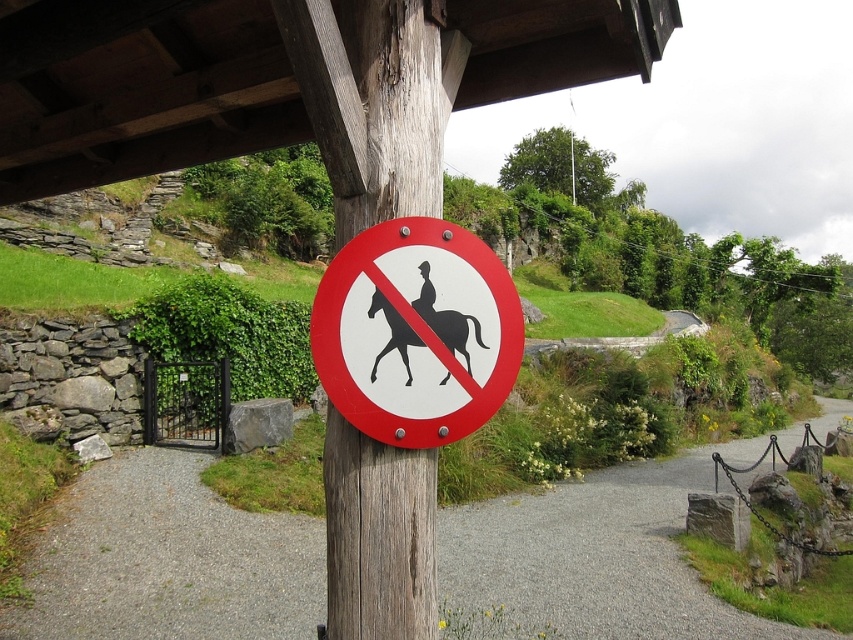
Can you confirm if wooden post at center is smaller than black matte horse at center?

No.

Can you confirm if wooden post at center is positioned to the left of black matte horse at center?

Yes, wooden post at center is to the left of black matte horse at center.

Between point (376, 164) and point (454, 340), which one is positioned behind?

Positioned behind is point (376, 164).

This screenshot has width=853, height=640. Find the location of `wooden post at center`. wooden post at center is located at coordinates (378, 536).

Does gravel path at center lie behind white paper sign at center?

Yes, gravel path at center is behind white paper sign at center.

Is gravel path at center taller than white paper sign at center?

Yes, gravel path at center is taller than white paper sign at center.

Is point (294, 563) behind point (370, 362)?

That is True.

I want to click on gravel path at center, so click(x=169, y=561).

Can you confirm if wooden post at center is thinner than white paper sign at center?

Correct, wooden post at center's width is less than white paper sign at center's.

Does wooden post at center have a larger size compared to white paper sign at center?

Yes, wooden post at center is bigger than white paper sign at center.

At what (x,y) coordinates should I click in order to perform the action: click on wooden post at center. Please return your answer as a coordinate pair (x, y). Looking at the image, I should click on (378, 536).